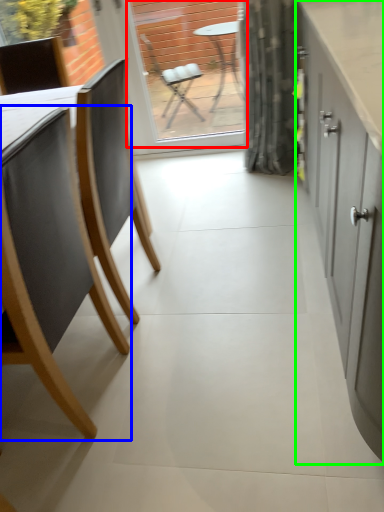
Question: Which object is positioned closest to window screen (highlighted by a red box)? Select from chair (highlighted by a blue box) and cabinetry (highlighted by a green box).

Choices:
 (A) chair
 (B) cabinetry

Answer: (B)